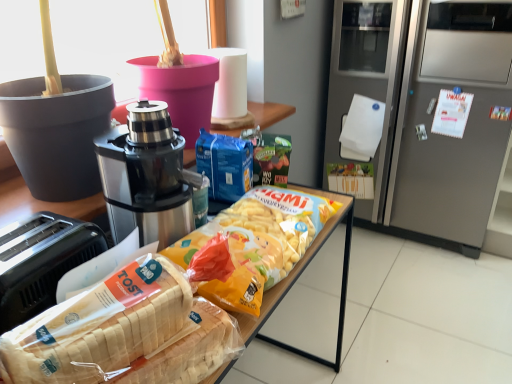
Question: Considering the relative positions of white plastic bread at lower left and satin silver refrigerator at right in the image provided, is white plastic bread at lower left to the left of satin silver refrigerator at right from the viewer's perspective?

Choices:
 (A) no
 (B) yes

Answer: (B)

Question: Considering the relative sizes of white plastic bread at lower left and satin silver refrigerator at right in the image provided, is white plastic bread at lower left shorter than satin silver refrigerator at right?

Choices:
 (A) no
 (B) yes

Answer: (B)

Question: From a real-world perspective, is white plastic bread at lower left on top of satin silver refrigerator at right?

Choices:
 (A) no
 (B) yes

Answer: (B)

Question: Could you tell me if white plastic bread at lower left is facing satin silver refrigerator at right?

Choices:
 (A) no
 (B) yes

Answer: (A)

Question: Does white plastic bread at lower left have a smaller size compared to satin silver refrigerator at right?

Choices:
 (A) yes
 (B) no

Answer: (A)

Question: In terms of size, does stainless steel coffee maker at center appear bigger or smaller than white plastic bread at lower left?

Choices:
 (A) big
 (B) small

Answer: (A)

Question: From a real-world perspective, is stainless steel coffee maker at center physically located above or below white plastic bread at lower left?

Choices:
 (A) above
 (B) below

Answer: (A)

Question: Would you say stainless steel coffee maker at center is to the left or to the right of white plastic bread at lower left in the picture?

Choices:
 (A) left
 (B) right

Answer: (A)

Question: In the image, is stainless steel coffee maker at center positioned in front of or behind white plastic bread at lower left?

Choices:
 (A) front
 (B) behind

Answer: (B)

Question: Based on their positions, is satin silver refrigerator at right located to the left or right of stainless steel coffee maker at center?

Choices:
 (A) right
 (B) left

Answer: (A)

Question: Which is correct: satin silver refrigerator at right is inside stainless steel coffee maker at center, or outside of it?

Choices:
 (A) outside
 (B) inside

Answer: (A)

Question: From the image's perspective, relative to stainless steel coffee maker at center, is satin silver refrigerator at right above or below?

Choices:
 (A) above
 (B) below

Answer: (A)

Question: Is point (465, 190) positioned closer to the camera than point (133, 114)?

Choices:
 (A) farther
 (B) closer

Answer: (A)

Question: From the image's perspective, is white glossy refrigerator at right located above or below white plastic bread at lower left?

Choices:
 (A) below
 (B) above

Answer: (B)

Question: From a real-world perspective, is white glossy refrigerator at right physically located above or below white plastic bread at lower left?

Choices:
 (A) below
 (B) above

Answer: (B)